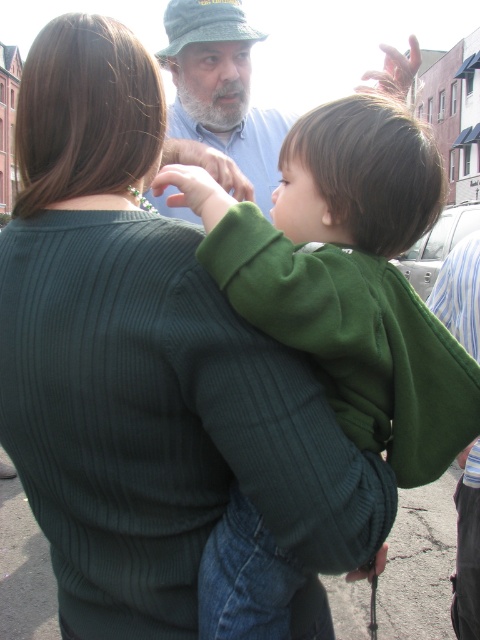
You are a fashion designer analyzing the image. You need to determine which clothing item is wider between the green corduroy sweater at center and the light blue shirt at upper center. Which one is wider?

The green corduroy sweater at center is wider than the light blue shirt at upper center according to the description.

You are a photographer trying to capture a candid shot of the scene. You want to focus on the green corduroy sweater at center and the light blue shirt at upper center. Which subject is closer to the camera?

The green corduroy sweater at center is closer to the camera because it is in front of the light blue shirt at upper center.